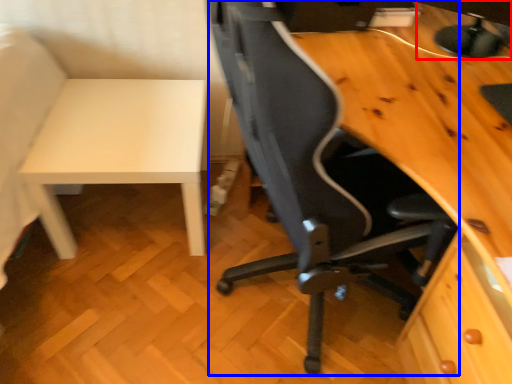
Question: Which object is further to the camera taking this photo, computer monitor (highlighted by a red box) or chair (highlighted by a blue box)?

Choices:
 (A) computer monitor
 (B) chair

Answer: (A)